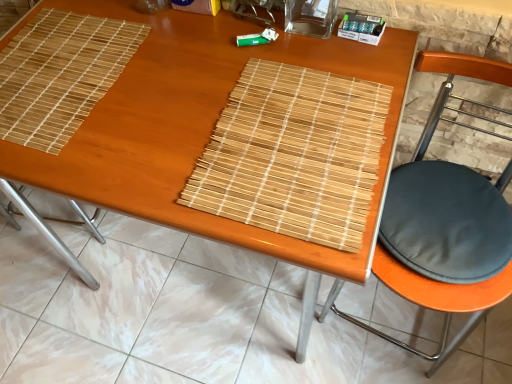
Identify the location of free point above bamboo placemat at center (from a real-world perspective). The height and width of the screenshot is (384, 512). (173, 313).